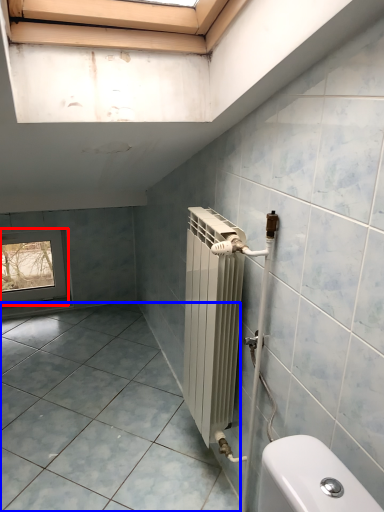
Question: Which point is closer to the camera, window (highlighted by a red box) or ceramic tile (highlighted by a blue box)?

Choices:
 (A) window
 (B) ceramic tile

Answer: (B)